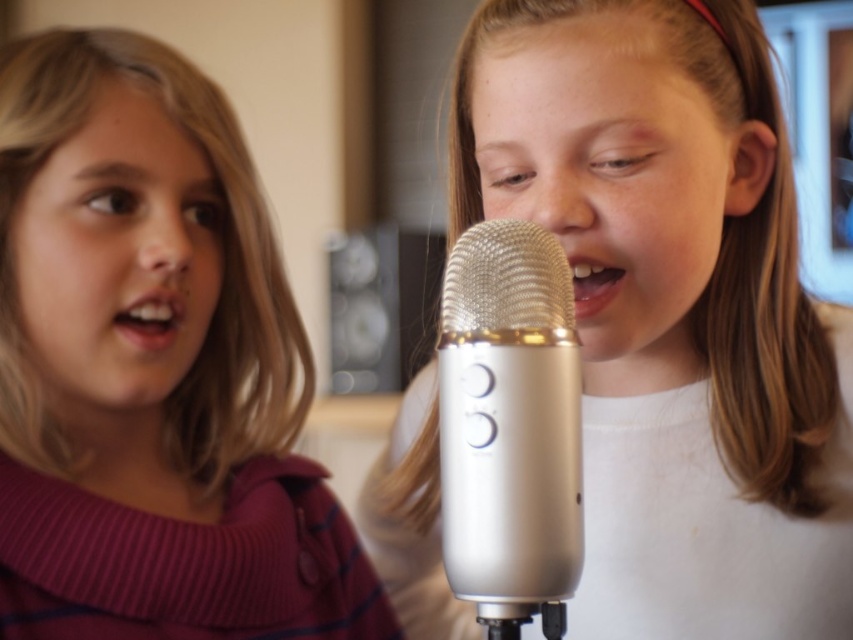
Question: Is matte pink sweater at left closer to the viewer compared to silver metallic microphone at center?

Choices:
 (A) yes
 (B) no

Answer: (B)

Question: Is matte pink sweater at left to the left of silver metallic microphone at center from the viewer's perspective?

Choices:
 (A) no
 (B) yes

Answer: (B)

Question: Estimate the real-world distances between objects in this image. Which object is closer to the silver metallic microphone at center?

Choices:
 (A) white matte microphone at center
 (B) matte pink sweater at left

Answer: (A)

Question: Among these objects, which one is farthest from the camera?

Choices:
 (A) white matte microphone at center
 (B) silver metallic microphone at center
 (C) matte pink sweater at left

Answer: (A)

Question: Which point is closer to the camera?

Choices:
 (A) silver metallic microphone at center
 (B) white matte microphone at center
 (C) matte pink sweater at left

Answer: (A)

Question: Can you confirm if white matte microphone at center is thinner than matte pink sweater at left?

Choices:
 (A) no
 (B) yes

Answer: (A)